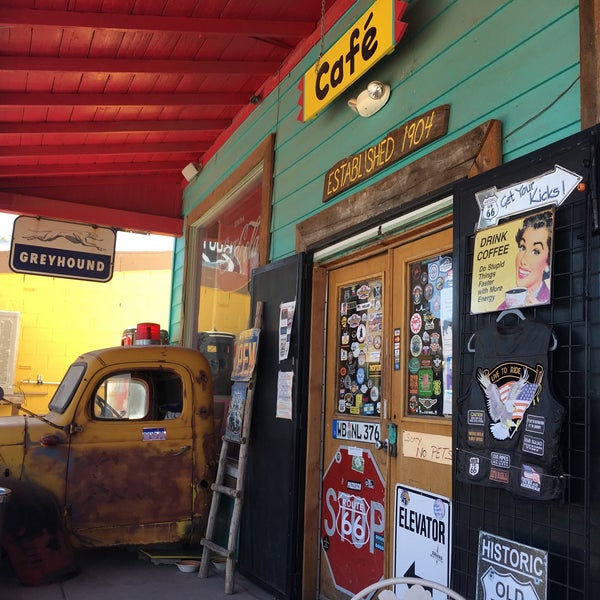
Locate an element on the screen. The height and width of the screenshot is (600, 600). window is located at coordinates (142, 402).